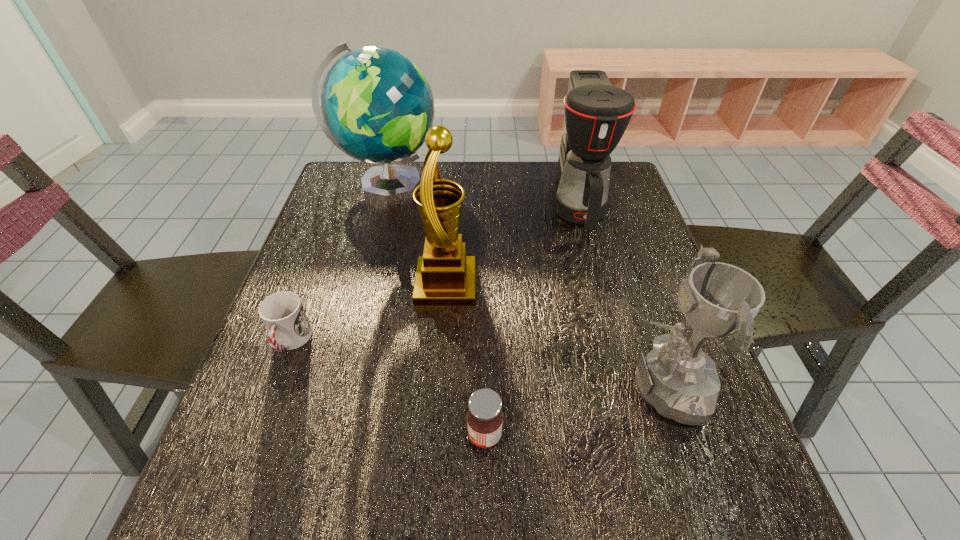
Image resolution: width=960 pixels, height=540 pixels. What are the coordinates of `vacant space at the far right corner` in the screenshot? It's located at (617, 179).

The width and height of the screenshot is (960, 540). In order to click on vacant space at the near right corner in this screenshot , I will do `click(752, 490)`.

Locate an element on the screen. vacant area that lies between the jam and the shorter award is located at coordinates (571, 410).

Where is `unoccupied position between the farther award and the coffee maker`? This screenshot has width=960, height=540. unoccupied position between the farther award and the coffee maker is located at coordinates (513, 246).

At what (x,y) coordinates should I click in order to perform the action: click on blank region between the second shortest object and the shortest object. Please return your answer as a coordinate pair (x, y). The height and width of the screenshot is (540, 960). Looking at the image, I should click on (388, 388).

Image resolution: width=960 pixels, height=540 pixels. I want to click on empty location between the coffee maker and the taller award, so click(513, 246).

Where is `free space between the left award and the jam`? The width and height of the screenshot is (960, 540). free space between the left award and the jam is located at coordinates (466, 360).

Find the location of `free space between the taller award and the shorter award`. free space between the taller award and the shorter award is located at coordinates (552, 335).

At what (x,y) coordinates should I click in order to perform the action: click on empty location between the cup and the shorter award. Please return your answer as a coordinate pair (x, y). The height and width of the screenshot is (540, 960). Looking at the image, I should click on (474, 363).

Identify the location of vacant region between the globe and the left award. The height and width of the screenshot is (540, 960). (417, 235).